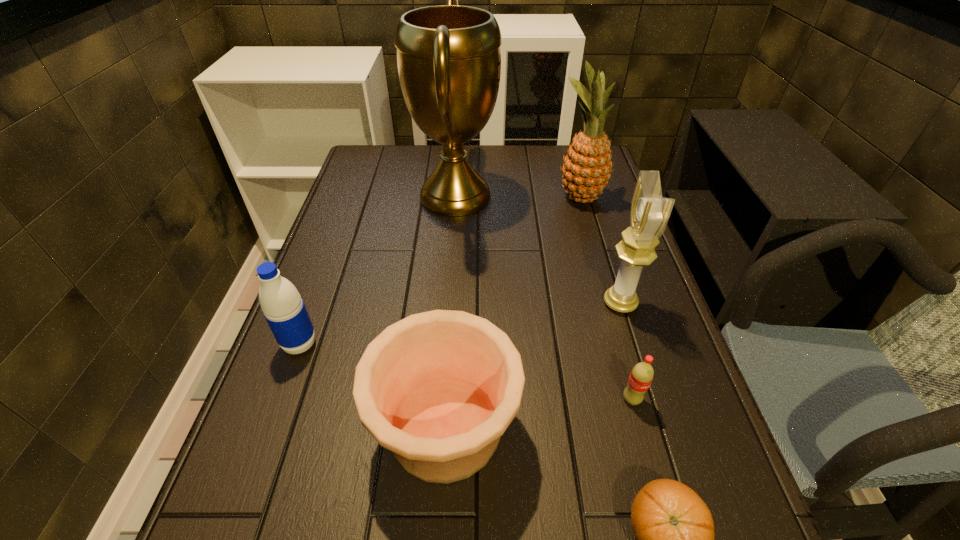
In order to click on free region located 0.380m on the front-facing side of the fifth shortest object in this screenshot , I will do `click(441, 303)`.

You are a GUI agent. You are given a task and a screenshot of the screen. Output one action in this format:
    pyautogui.click(x=<x>, y=<y>)
    Task: Click on the free location located on the front-facing side of the fifth shortest object
    Image resolution: width=960 pixels, height=540 pixels.
    Given the screenshot: What is the action you would take?
    pyautogui.click(x=514, y=303)

What are the coordinates of `vacant space located 0.260m on the front-facing side of the fifth shortest object` in the screenshot? It's located at (492, 303).

Image resolution: width=960 pixels, height=540 pixels. I want to click on vacant space positioned on the back of the leftmost object, so click(313, 307).

Where is `vacant region located on the left of the pottery`? The image size is (960, 540). vacant region located on the left of the pottery is located at coordinates (290, 428).

Locate an element on the screen. vacant space located 0.140m on the back of the soda is located at coordinates (613, 334).

Find the location of a particular element. This screenshot has width=960, height=540. object that is at the far edge is located at coordinates (449, 61).

At what (x,y) coordinates should I click in order to perform the action: click on object at the left edge. Please return your answer as a coordinate pair (x, y). This screenshot has width=960, height=540. Looking at the image, I should click on click(283, 308).

You are a GUI agent. You are given a task and a screenshot of the screen. Output one action in this format:
    pyautogui.click(x=<x>, y=<y>)
    Task: Click on the pineapple that is at the right edge
    
    Given the screenshot: What is the action you would take?
    pyautogui.click(x=586, y=170)

Locate an element on the screen. Image resolution: width=960 pixels, height=540 pixels. award that is at the right edge is located at coordinates (649, 214).